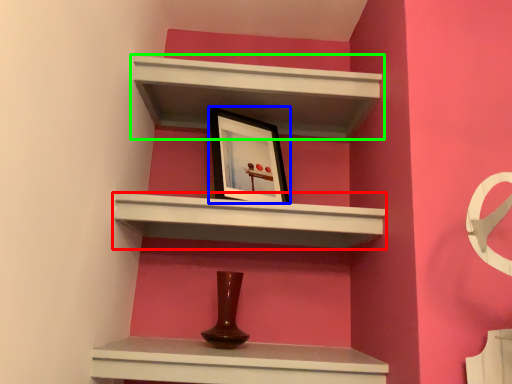
Question: Which is farther away from shelf (highlighted by a red box)? picture frame (highlighted by a blue box) or shelf (highlighted by a green box)?

Choices:
 (A) picture frame
 (B) shelf

Answer: (B)